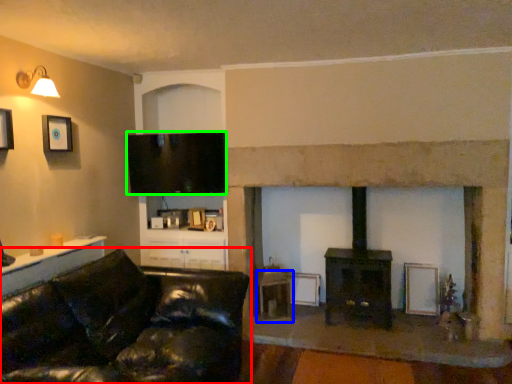
Question: Considering the real-world distances, which object is closest to studio couch (highlighted by a red box)? table (highlighted by a blue box) or television (highlighted by a green box).

Choices:
 (A) table
 (B) television

Answer: (B)